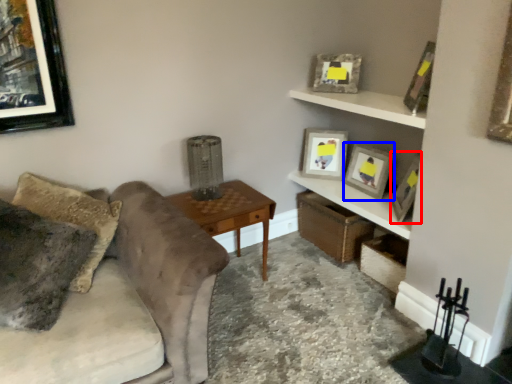
Question: Which object appears farthest to the camera in this image, picture frame (highlighted by a red box) or picture frame (highlighted by a blue box)?

Choices:
 (A) picture frame
 (B) picture frame

Answer: (B)